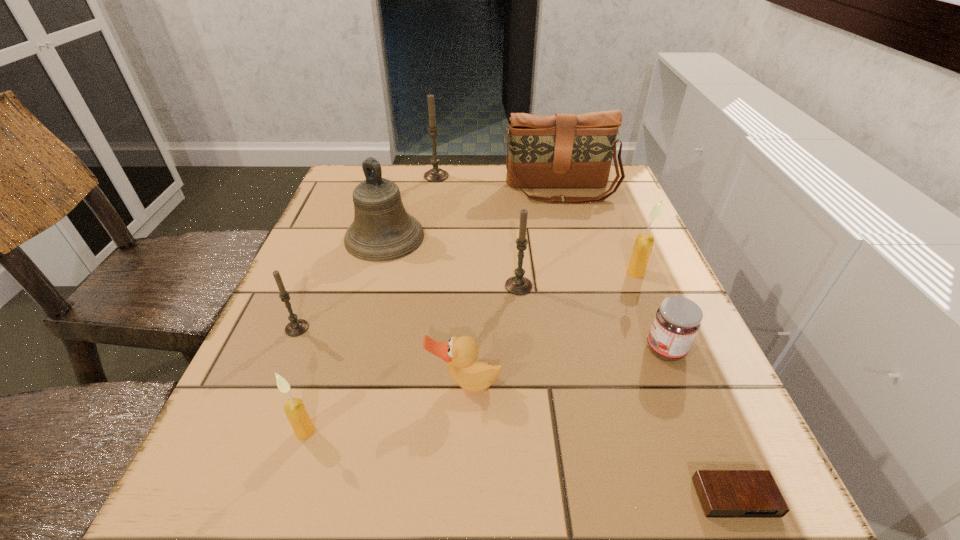
I want to click on vacant area that lies between the nearest object and the bigger cream candle, so click(685, 385).

In order to click on free area in between the shortest object and the second biggest gray candle in this screenshot , I will do click(627, 392).

What are the coordinates of `object that is the sixth closest one to the shoulder bag` in the screenshot? It's located at (460, 354).

Image resolution: width=960 pixels, height=540 pixels. What are the coordinates of `object that stands as the second closest to the left cream candle` in the screenshot? It's located at (296, 327).

Where is `candle that is the third nearest to the sixth object from right to left`? The image size is (960, 540). candle that is the third nearest to the sixth object from right to left is located at coordinates (296, 327).

Find the location of a particular element. Image resolution: width=960 pixels, height=540 pixels. candle identified as the fourth closest to the fourth candle from left to right is located at coordinates (435, 174).

The width and height of the screenshot is (960, 540). Find the location of `gray candle that is the closest to the third farthest object`. gray candle that is the closest to the third farthest object is located at coordinates (435, 174).

Locate an element on the screen. gray candle that is the closest one to the alarm clock is located at coordinates (518, 285).

At what (x,y) coordinates should I click in order to perform the action: click on vacant region that satisfies the following two spatial constraints: 1. on the back side of the right cream candle; 2. on the left side of the jam. Please return your answer as a coordinate pair (x, y). The height and width of the screenshot is (540, 960). Looking at the image, I should click on (635, 273).

You are a GUI agent. You are given a task and a screenshot of the screen. Output one action in this format:
    pyautogui.click(x=<x>, y=<y>)
    Task: Click on the blank space that satisfies the following two spatial constraints: 1. on the front side of the jam; 2. on the left side of the farthest gray candle
    The height and width of the screenshot is (540, 960).
    Given the screenshot: What is the action you would take?
    pyautogui.click(x=410, y=349)